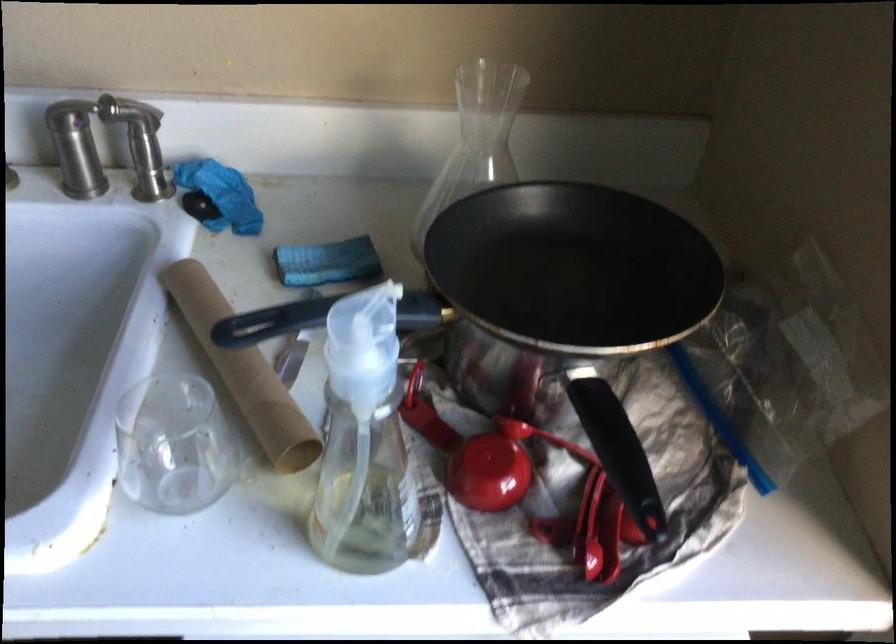
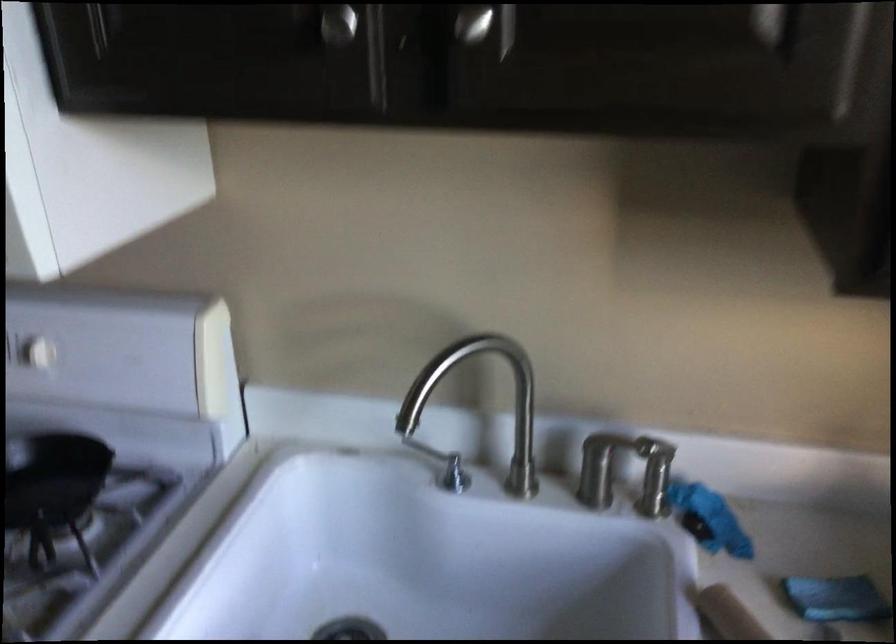
Which direction would the cameraman need to move to produce the second image?

Answer: The cameraman walked toward left, backward.